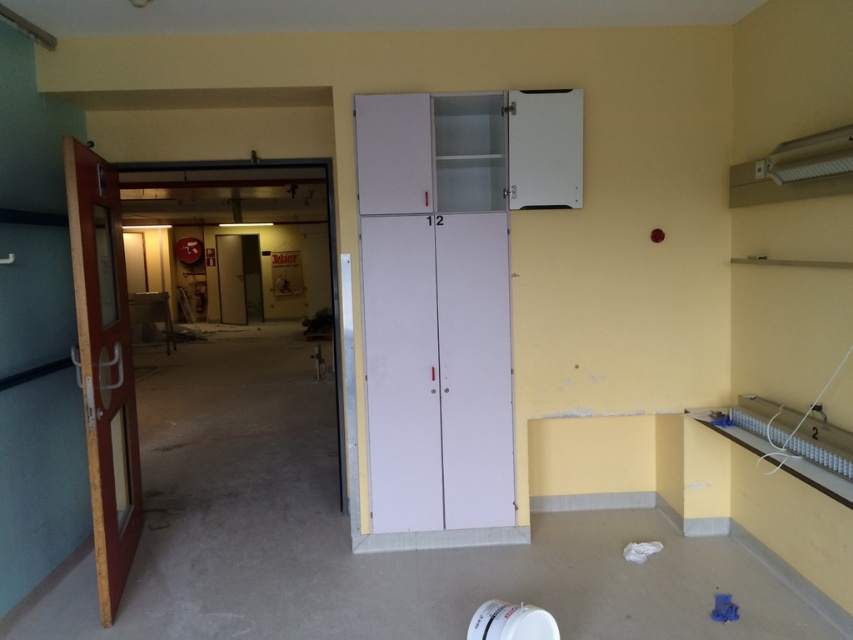
What do you see at coordinates (437, 371) in the screenshot? I see `white matte cabinet at center` at bounding box center [437, 371].

The height and width of the screenshot is (640, 853). Identify the location of white matte cabinet at center. (437, 371).